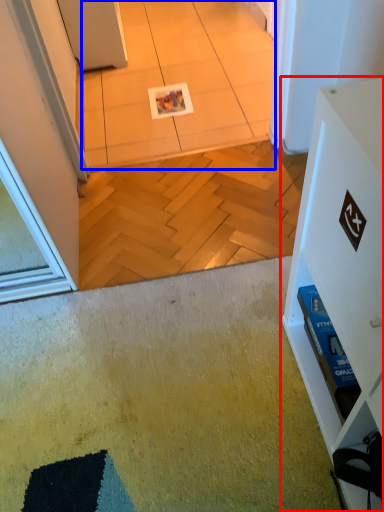
Question: Among these objects, which one is farthest to the camera, furniture (highlighted by a red box) or tile (highlighted by a blue box)?

Choices:
 (A) furniture
 (B) tile

Answer: (B)